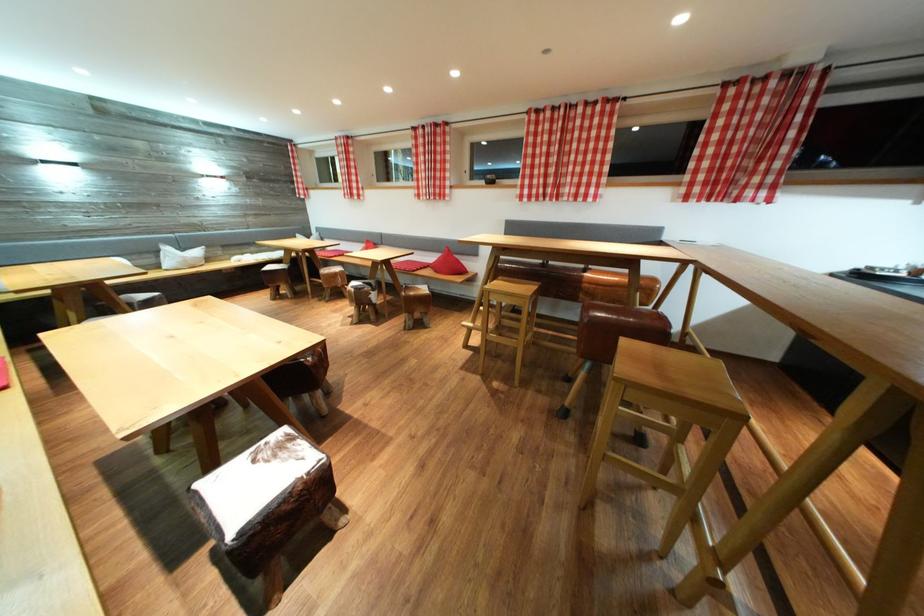
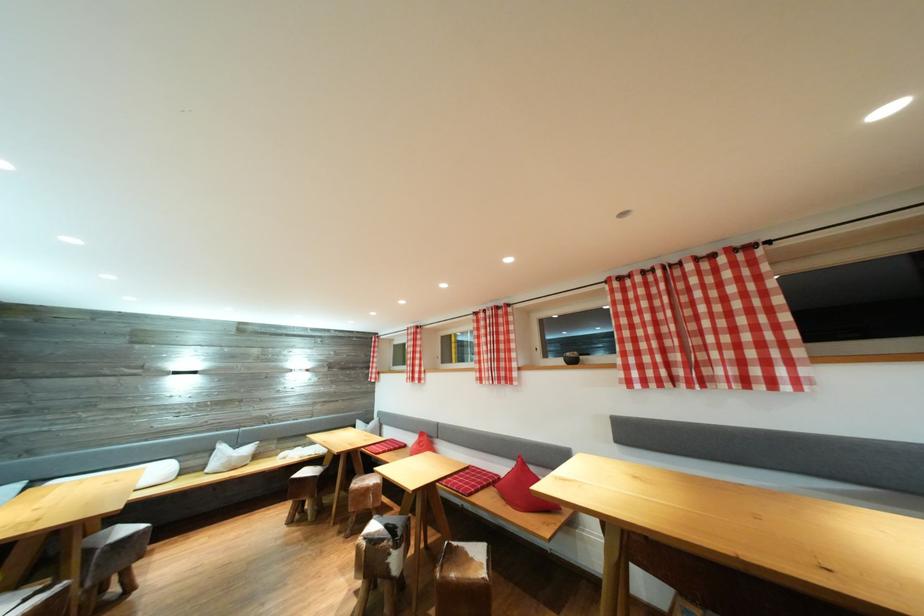
Find the pixel in the second image that matches pixel 495 182 in the first image.

(575, 360)